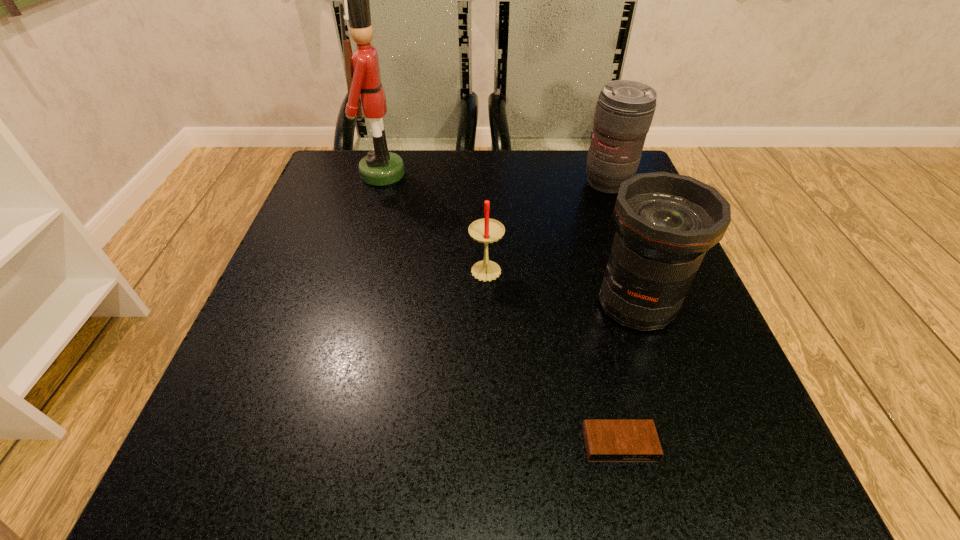
In order to click on vacant point located between the candle and the nearest object in this screenshot , I will do `click(553, 359)`.

At what (x,y) coordinates should I click in order to perform the action: click on vacant area that lies between the leftmost object and the shortest object. Please return your answer as a coordinate pair (x, y). This screenshot has width=960, height=540. Looking at the image, I should click on (501, 309).

Point out which object is positioned as the third nearest to the candle. Please provide its 2D coordinates. Your answer should be formatted as a tuple, i.e. [(x, y)], where the tuple contains the x and y coordinates of a point satisfying the conditions above.

[(624, 111)]

Identify the location of the third closest object to the alarm clock. (624, 111).

Find the location of a particular element. The image size is (960, 540). free spot that satisfies the following two spatial constraints: 1. on the back side of the nearer telephoto lens; 2. on the front-facing side of the nutcracker is located at coordinates 592,174.

You are a GUI agent. You are given a task and a screenshot of the screen. Output one action in this format:
    pyautogui.click(x=<x>, y=<y>)
    Task: Click on the free spot that satisfies the following two spatial constraints: 1. on the front-facing side of the tallest object; 2. on the right side of the second shortest object
    
    Given the screenshot: What is the action you would take?
    pyautogui.click(x=354, y=274)